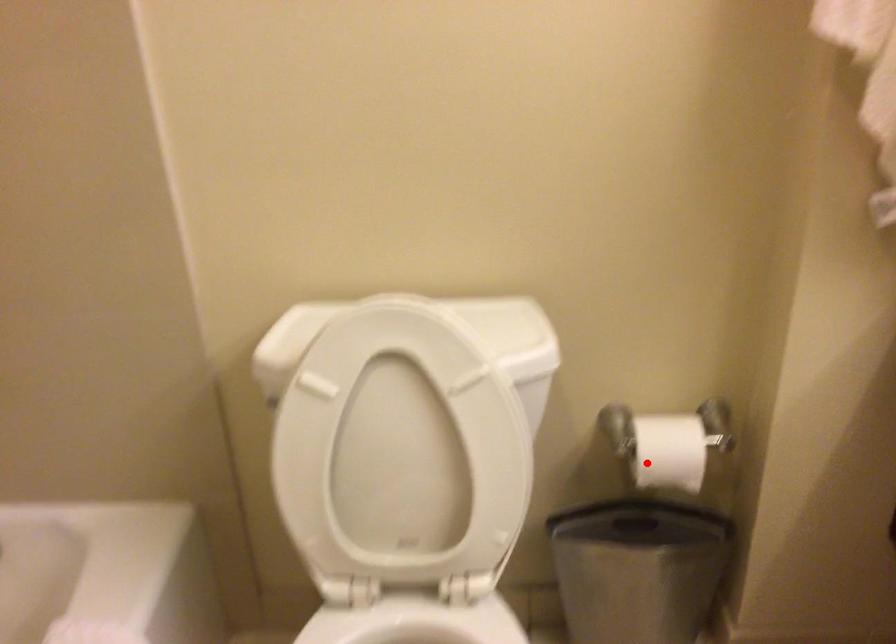
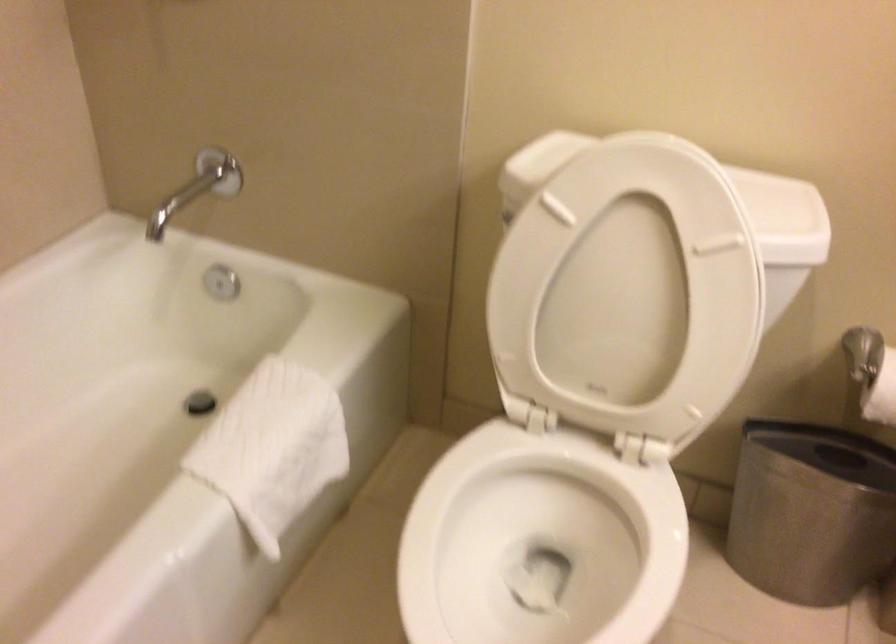
Question: I am providing you with two images of the same scene from different viewpoints. A red point is shown in image1. For the corresponding object point in image2, is it positioned nearer or farther from the camera?

Choices:
 (A) Nearer
 (B) Farther

Answer: (A)